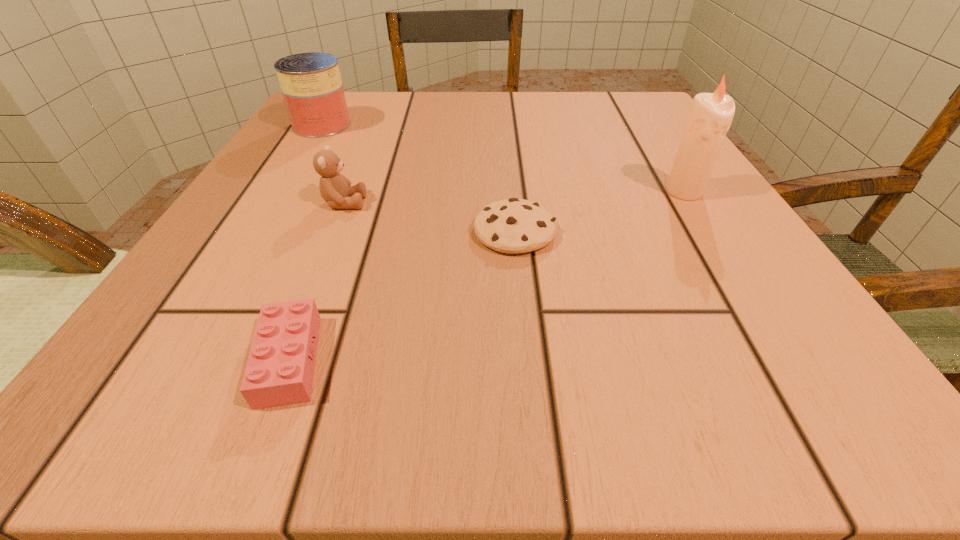
At what (x,y) coordinates should I click in order to perform the action: click on vacant area situated on the front of the cookie. Please return your answer as a coordinate pair (x, y). Image resolution: width=960 pixels, height=540 pixels. Looking at the image, I should click on (x=519, y=284).

The height and width of the screenshot is (540, 960). In order to click on vacant region located 0.060m on the left of the nearest object in this screenshot , I will do `click(198, 360)`.

Where is `object that is at the far edge`? object that is at the far edge is located at coordinates (311, 85).

Locate an element on the screen. The height and width of the screenshot is (540, 960). object positioned at the near edge is located at coordinates (280, 369).

The image size is (960, 540). What are the coordinates of `can located in the left edge section of the desktop` in the screenshot? It's located at (311, 85).

I want to click on teddy bear that is at the left edge, so click(x=335, y=189).

Where is `Lego positioned at the left edge`? Lego positioned at the left edge is located at coordinates (280, 369).

The height and width of the screenshot is (540, 960). In order to click on object that is at the right edge in this screenshot , I will do `click(711, 115)`.

At what (x,y) coordinates should I click in order to perform the action: click on object situated at the far left corner. Please return your answer as a coordinate pair (x, y). Looking at the image, I should click on (311, 85).

This screenshot has width=960, height=540. Find the location of `object located in the near left corner section of the desktop`. object located in the near left corner section of the desktop is located at coordinates (280, 369).